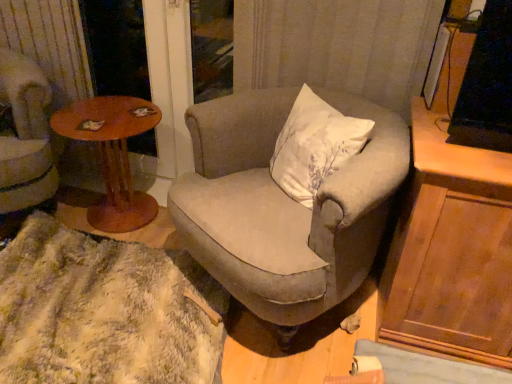
Question: From the image's perspective, is wooden cabinet at right above textured beige armchair at center, which is the 2th chair in left-to-right order?

Choices:
 (A) yes
 (B) no

Answer: (B)

Question: Is wooden cabinet at right looking in the opposite direction of textured beige armchair at center, which ranks as the 1th chair in right-to-left order?

Choices:
 (A) no
 (B) yes

Answer: (A)

Question: Can you confirm if wooden cabinet at right is wider than textured beige armchair at center, which is the 2th chair in left-to-right order?

Choices:
 (A) no
 (B) yes

Answer: (A)

Question: Is wooden cabinet at right closer to the viewer compared to textured beige armchair at center, which is the 2th chair in left-to-right order?

Choices:
 (A) yes
 (B) no

Answer: (B)

Question: Is wooden cabinet at right outside textured beige armchair at center, which is the 2th chair in left-to-right order?

Choices:
 (A) no
 (B) yes

Answer: (B)

Question: From a real-world perspective, is wooden cabinet at right under textured beige armchair at center, which ranks as the 1th chair in right-to-left order?

Choices:
 (A) no
 (B) yes

Answer: (A)

Question: Is velvet beige armchair at left, the first chair in the left-to-right sequence, located within brown wooden screen door at upper left?

Choices:
 (A) no
 (B) yes

Answer: (A)

Question: Is brown wooden screen door at upper left placed right next to velvet beige armchair at left, acting as the second chair starting from the right?

Choices:
 (A) yes
 (B) no

Answer: (B)

Question: Is brown wooden screen door at upper left closer to camera compared to velvet beige armchair at left, the first chair in the left-to-right sequence?

Choices:
 (A) yes
 (B) no

Answer: (B)

Question: Is brown wooden screen door at upper left at the right side of velvet beige armchair at left, the first chair in the left-to-right sequence?

Choices:
 (A) no
 (B) yes

Answer: (B)

Question: Considering the relative sizes of brown wooden screen door at upper left and velvet beige armchair at left, acting as the second chair starting from the right, in the image provided, is brown wooden screen door at upper left bigger than velvet beige armchair at left, acting as the second chair starting from the right,?

Choices:
 (A) yes
 (B) no

Answer: (B)

Question: Are brown wooden screen door at upper left and velvet beige armchair at left, acting as the second chair starting from the right, far apart?

Choices:
 (A) no
 (B) yes

Answer: (A)

Question: Is wooden round table at left behind textured beige armchair at center, which ranks as the 1th chair in right-to-left order?

Choices:
 (A) no
 (B) yes

Answer: (B)